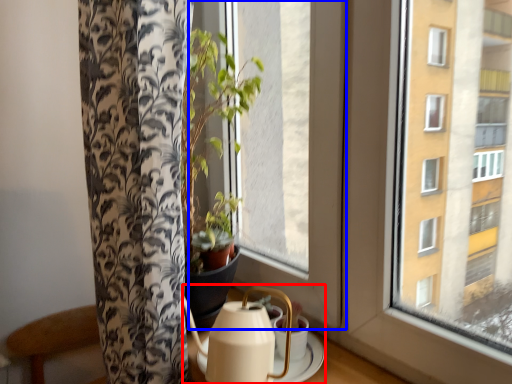
Question: Which of the following is the farthest to the observer, tea set (highlighted by a red box) or window (highlighted by a blue box)?

Choices:
 (A) tea set
 (B) window

Answer: (B)